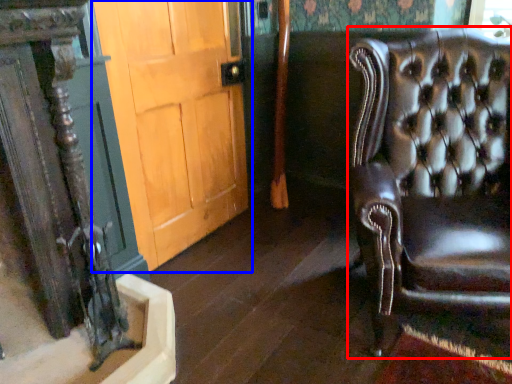
Question: Among these objects, which one is farthest to the camera, chair (highlighted by a red box) or door (highlighted by a blue box)?

Choices:
 (A) chair
 (B) door

Answer: (B)